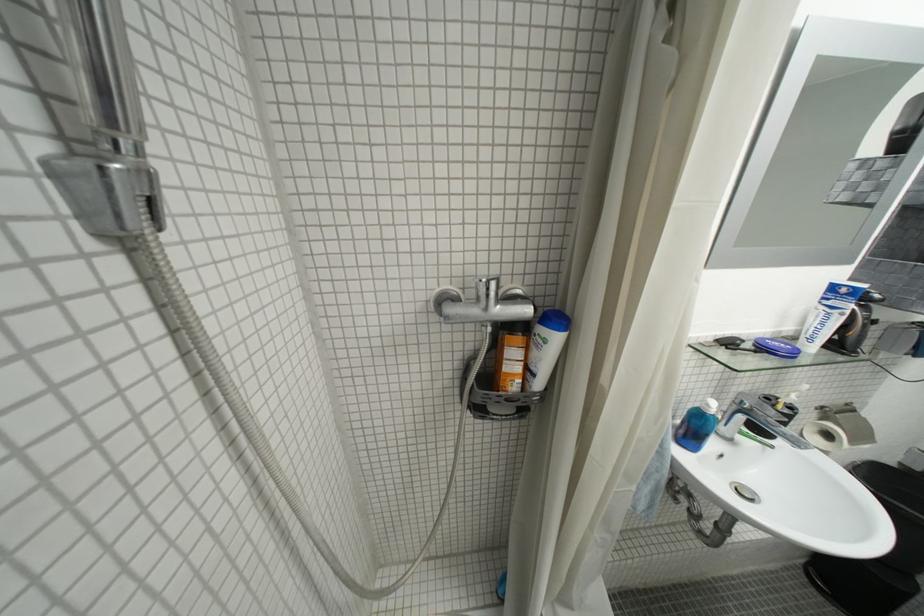
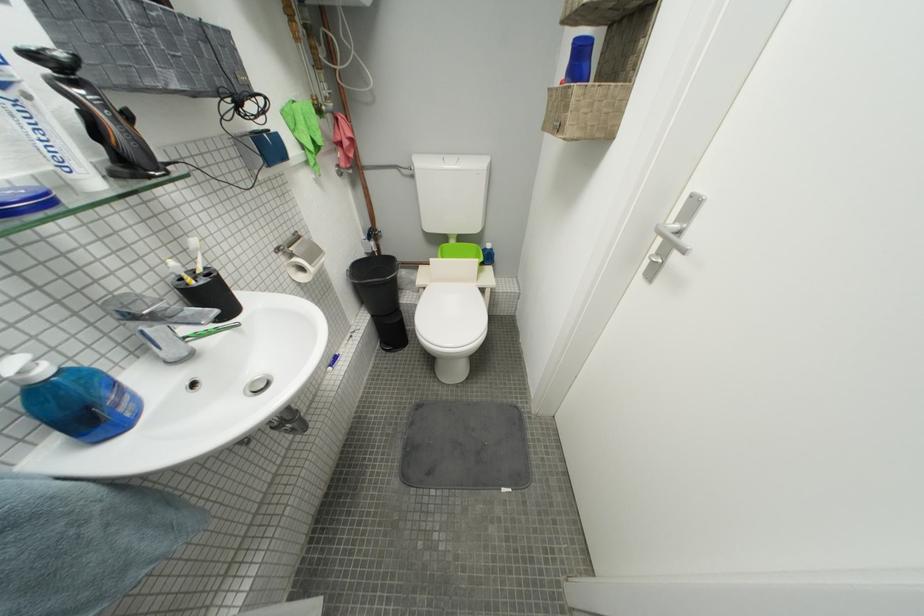
How did the camera likely rotate?

The camera rotated toward right-down.